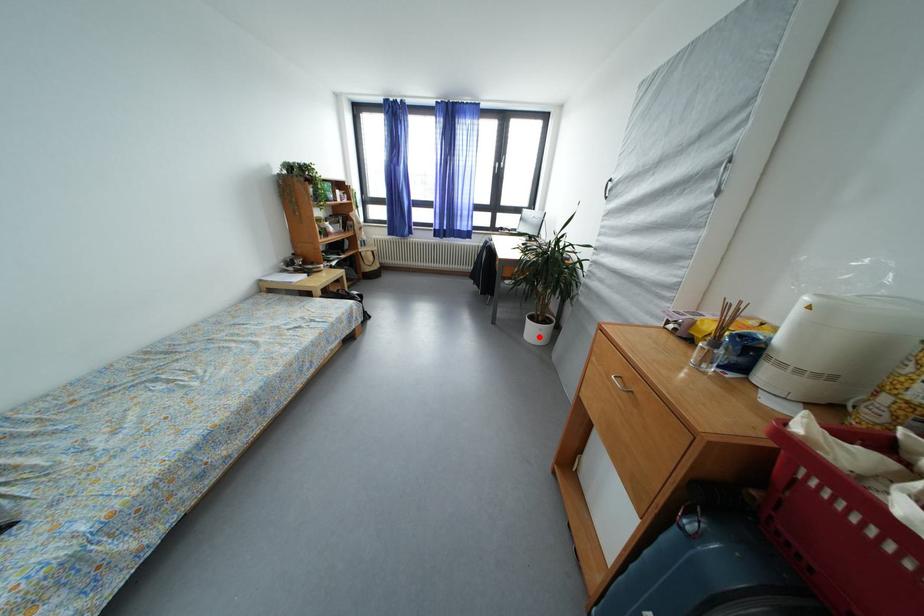
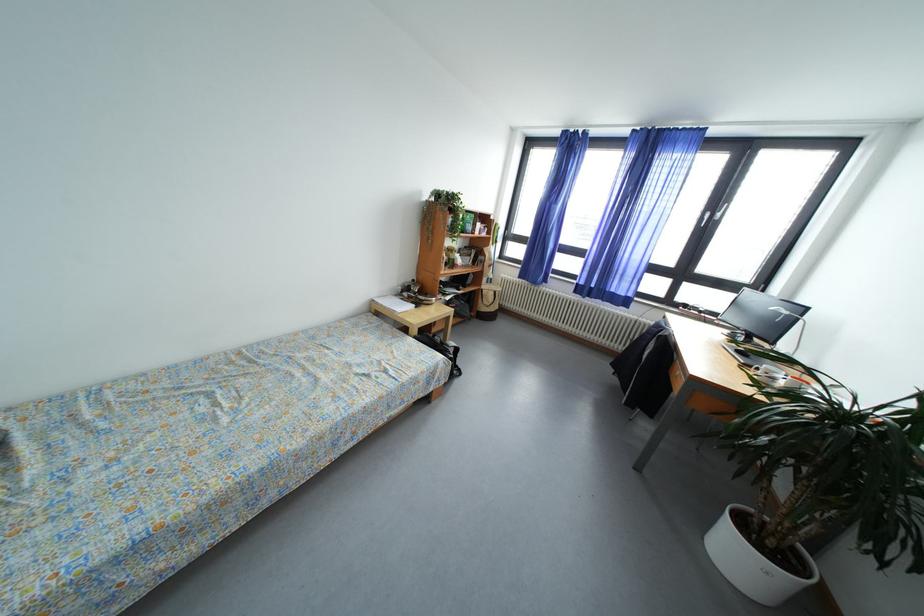
Question: I am providing you with two images of the same scene from different viewpoints. In image1, a red point is highlighted. Considering the same 3D point in image2, which of the following is correct?

Choices:
 (A) It is closer
 (B) It is farther

Answer: (B)